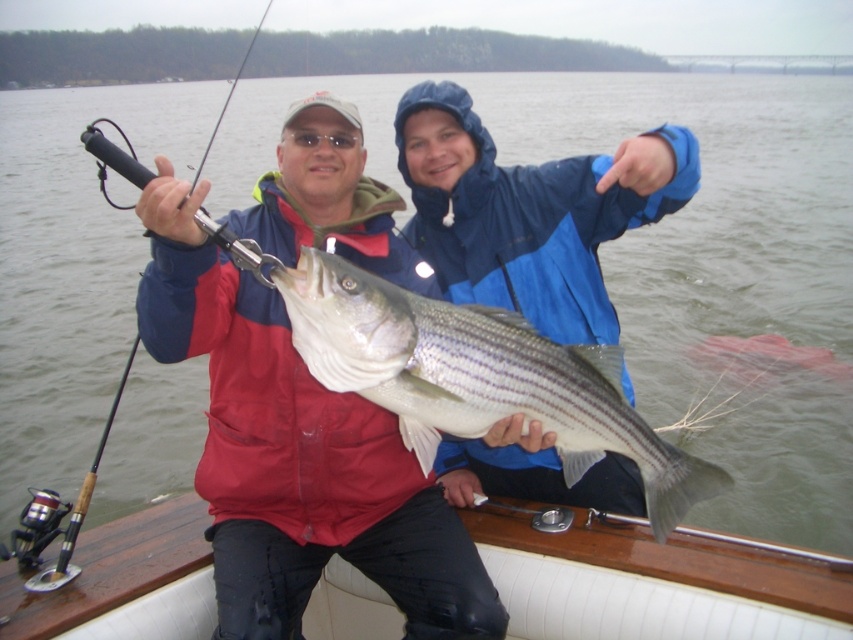
Question: Which of the following is the closest to the observer?

Choices:
 (A) matte red jacket at center
 (B) matte black fishing rod at left

Answer: (A)

Question: Which point is farther to the camera?

Choices:
 (A) (323, 204)
 (B) (317, 250)

Answer: (A)

Question: Does matte red jacket at center appear on the right side of white glossy fish at center?

Choices:
 (A) no
 (B) yes

Answer: (A)

Question: Can you confirm if white wood boat at center is positioned below white glossy fish at center?

Choices:
 (A) no
 (B) yes

Answer: (B)

Question: Based on their relative distances, which object is farther from the white wood boat at center?

Choices:
 (A) matte black fishing rod at left
 (B) matte red jacket at center

Answer: (A)

Question: Can you confirm if matte red jacket at center is positioned to the left of white wood boat at center?

Choices:
 (A) yes
 (B) no

Answer: (A)